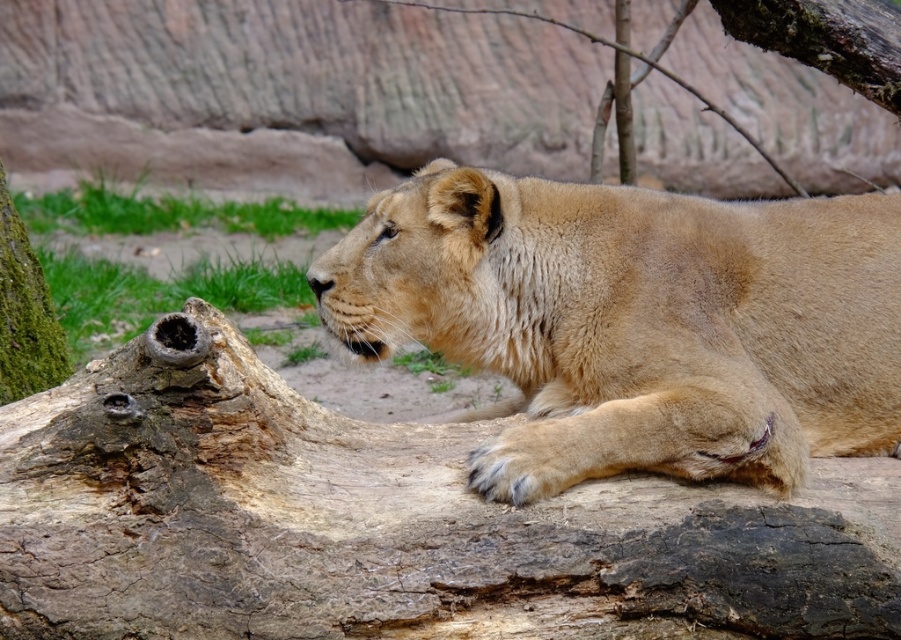
You are a wildlife photographer trying to capture a closeup of the fuzzy golden lion at center while avoiding the brown rough tree trunk at center. Given that your camera has a depth of field that can focus on objects within 30 centimeters of each other, will you be able to blur the tree trunk and keep the lion in focus?

The distance between the brown rough tree trunk at center and the fuzzy golden lion at center is 31.39 centimeters. Since the camera can only focus on objects within 30 centimeters of each other, the 31.39 cm distance exceeds this limit. Therefore, you won cannot blur the tree trunk while keeping the lion in focus.

You are a wildlife photographer trying to capture a closeup shot of the fuzzy golden lion at center. You need to ensure that the brown rough tree trunk at center doesn not block the lion in the photo. Based on their sizes, will the tree trunk at center be wider than the lion when framed in your camera?

The brown rough tree trunk at center is wider than the fuzzy golden lion at center, so yes, the tree trunk at center will be wider and may block the lion in the photo.

You are a wildlife photographer aiming to capture the lioness resting on the tree trunk. You notice a specific point marked at coordinates (389, 524). Where is this point located in relation to the lioness and the tree trunk?

The point at (389, 524) is on the brown rough tree trunk at center, so it is part of the tree trunk where the lioness is resting.